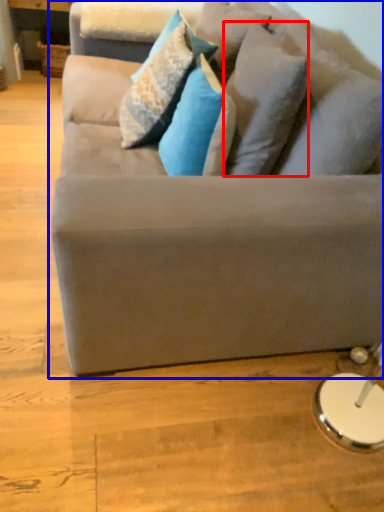
Question: Which point is closer to the camera, pillow (highlighted by a red box) or studio couch (highlighted by a blue box)?

Choices:
 (A) pillow
 (B) studio couch

Answer: (B)